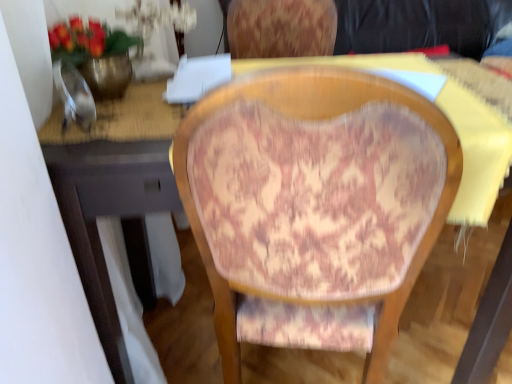
Where is `patterned fabric chair at center`? This screenshot has width=512, height=384. patterned fabric chair at center is located at coordinates (314, 202).

Describe the element at coordinates (314, 202) in the screenshot. The image size is (512, 384). I see `patterned fabric chair at center` at that location.

Measure the distance between point (207, 270) and camera.

A distance of 28.58 inches exists between point (207, 270) and camera.

Identify the location of metallic gold vase at upper left. Image resolution: width=512 pixels, height=384 pixels. (96, 54).

What do you see at coordinates (96, 54) in the screenshot? This screenshot has height=384, width=512. I see `metallic gold vase at upper left` at bounding box center [96, 54].

At what (x,y) coordinates should I click in order to perform the action: click on patterned fabric chair at center. Please return your answer as a coordinate pair (x, y). The height and width of the screenshot is (384, 512). Looking at the image, I should click on (314, 202).

Can you confirm if patterned fabric chair at center is positioned to the right of metallic gold vase at upper left?

Yes.

Considering the relative positions of patterned fabric chair at center and metallic gold vase at upper left in the image provided, is patterned fabric chair at center in front of metallic gold vase at upper left?

Yes, it is.

Between point (393, 165) and point (72, 20), which one is positioned behind?

The point (72, 20) is farther from the camera.

From the image's perspective, which is above, patterned fabric chair at center or metallic gold vase at upper left?

From the image's view, metallic gold vase at upper left is above.

From a real-world perspective, who is located lower, patterned fabric chair at center or metallic gold vase at upper left?

patterned fabric chair at center.

Does patterned fabric chair at center have a greater width compared to metallic gold vase at upper left?

Yes, patterned fabric chair at center is wider than metallic gold vase at upper left.

Who is taller, patterned fabric chair at center or metallic gold vase at upper left?

Standing taller between the two is patterned fabric chair at center.

Is patterned fabric chair at center bigger than metallic gold vase at upper left?

Yes.

Is patterned fabric chair at center not within metallic gold vase at upper left?

Yes.

Is patterned fabric chair at center touching metallic gold vase at upper left?

No, patterned fabric chair at center is not next to metallic gold vase at upper left.

Is patterned fabric chair at center looking in the opposite direction of metallic gold vase at upper left?

patterned fabric chair at center does not have its back to metallic gold vase at upper left.

Can you tell me how much patterned fabric chair at center and metallic gold vase at upper left differ in facing direction?

The angle between the facing direction of patterned fabric chair at center and the facing direction of metallic gold vase at upper left is 85.2 degrees.

You are a GUI agent. You are given a task and a screenshot of the screen. Output one action in this format:
    pyautogui.click(x=<x>, y=<y>)
    Task: Click on the floral arrangement above the patterned fabric chair at center (from a real-world perspective)
    
    Given the screenshot: What is the action you would take?
    pyautogui.click(x=96, y=54)

Considering the relative positions of metallic gold vase at upper left and patterned fabric chair at center in the image provided, is metallic gold vase at upper left to the left or to the right of patterned fabric chair at center?

metallic gold vase at upper left is positioned on patterned fabric chair at center's left side.

In the image, is metallic gold vase at upper left positioned in front of or behind patterned fabric chair at center?

In the image, metallic gold vase at upper left appears behind patterned fabric chair at center.

Is point (120, 36) positioned in front of point (295, 149)?

No, (120, 36) is behind (295, 149).

Consider the image. From the image's perspective, is metallic gold vase at upper left located beneath patterned fabric chair at center?

No, from the image's perspective, metallic gold vase at upper left is not beneath patterned fabric chair at center.

From a real-world perspective, between metallic gold vase at upper left and patterned fabric chair at center, who is vertically lower?

In real-world perspective, patterned fabric chair at center is lower.

Is metallic gold vase at upper left wider or thinner than patterned fabric chair at center?

In the image, metallic gold vase at upper left appears to be more narrow than patterned fabric chair at center.

Which of these two, metallic gold vase at upper left or patterned fabric chair at center, stands shorter?

Standing shorter between the two is metallic gold vase at upper left.

Can you confirm if metallic gold vase at upper left is bigger than patterned fabric chair at center?

No.

Would you say metallic gold vase at upper left is inside or outside patterned fabric chair at center?

metallic gold vase at upper left lies outside patterned fabric chair at center.

Would you consider metallic gold vase at upper left to be distant from patterned fabric chair at center?

No, metallic gold vase at upper left is not far from patterned fabric chair at center.

Is metallic gold vase at upper left aimed at patterned fabric chair at center?

Yes, metallic gold vase at upper left is facing patterned fabric chair at center.

How many degrees apart are the facing directions of metallic gold vase at upper left and patterned fabric chair at center?

85.2 degrees separate the facing orientations of metallic gold vase at upper left and patterned fabric chair at center.

Where is `chair on the right of metallic gold vase at upper left`? The width and height of the screenshot is (512, 384). chair on the right of metallic gold vase at upper left is located at coordinates (314, 202).

Where is `chair in front of the metallic gold vase at upper left`? The width and height of the screenshot is (512, 384). chair in front of the metallic gold vase at upper left is located at coordinates (314, 202).

Locate an element on the screen. Image resolution: width=512 pixels, height=384 pixels. floral arrangement located above the patterned fabric chair at center (from a real-world perspective) is located at coordinates (96, 54).